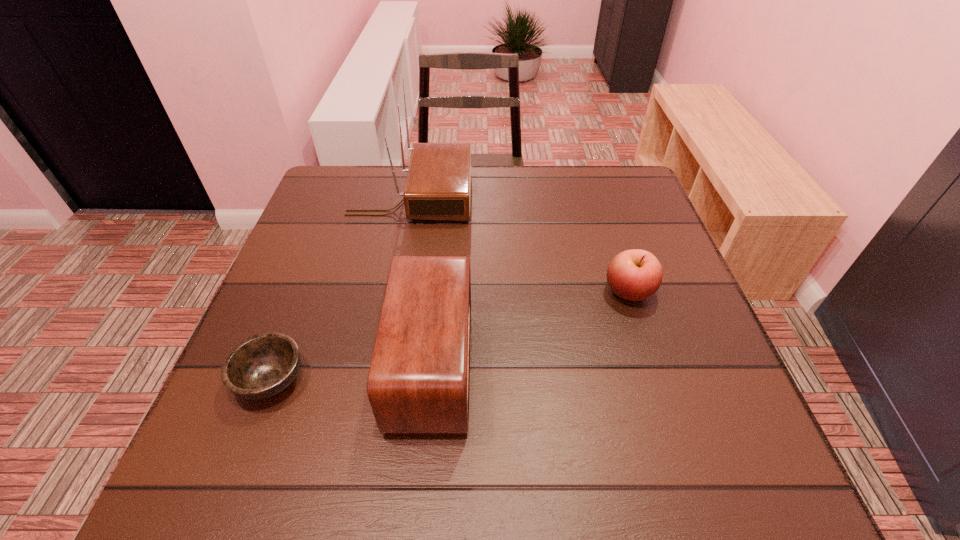
Where is `the tallest object`? the tallest object is located at coordinates (438, 183).

I want to click on the farther radio receiver, so click(x=438, y=183).

The image size is (960, 540). What are the coordinates of `the nearer radio receiver` in the screenshot? It's located at (419, 378).

Identify the location of the shorter radio receiver. (419, 378).

You are a GUI agent. You are given a task and a screenshot of the screen. Output one action in this format:
    pyautogui.click(x=<x>, y=<y>)
    Task: Click on the apple
    Image resolution: width=960 pixels, height=540 pixels.
    Given the screenshot: What is the action you would take?
    pyautogui.click(x=635, y=275)

Locate an element on the screen. The width and height of the screenshot is (960, 540). the rightmost object is located at coordinates (635, 275).

Locate an element on the screen. The height and width of the screenshot is (540, 960). the shortest object is located at coordinates (262, 366).

Where is `free spot located on the front panel of the tallest object`? The height and width of the screenshot is (540, 960). free spot located on the front panel of the tallest object is located at coordinates (554, 197).

This screenshot has width=960, height=540. I want to click on vacant space located on the front panel of the nearer radio receiver, so click(651, 364).

At what (x,y) coordinates should I click in order to perform the action: click on free region located 0.310m on the front of the rightmost object. Please return your answer as a coordinate pair (x, y). Image resolution: width=960 pixels, height=540 pixels. Looking at the image, I should click on (684, 458).